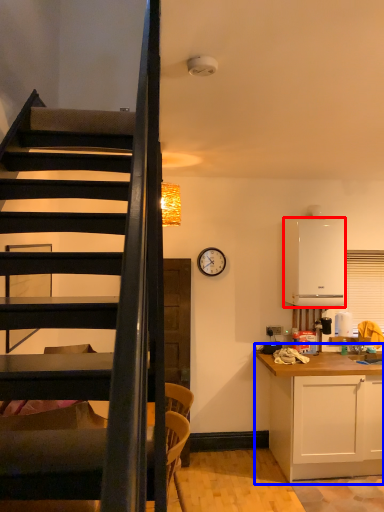
Question: Among these objects, which one is nearest to the camera, appliance (highlighted by a red box) or cabinetry (highlighted by a blue box)?

Choices:
 (A) appliance
 (B) cabinetry

Answer: (B)